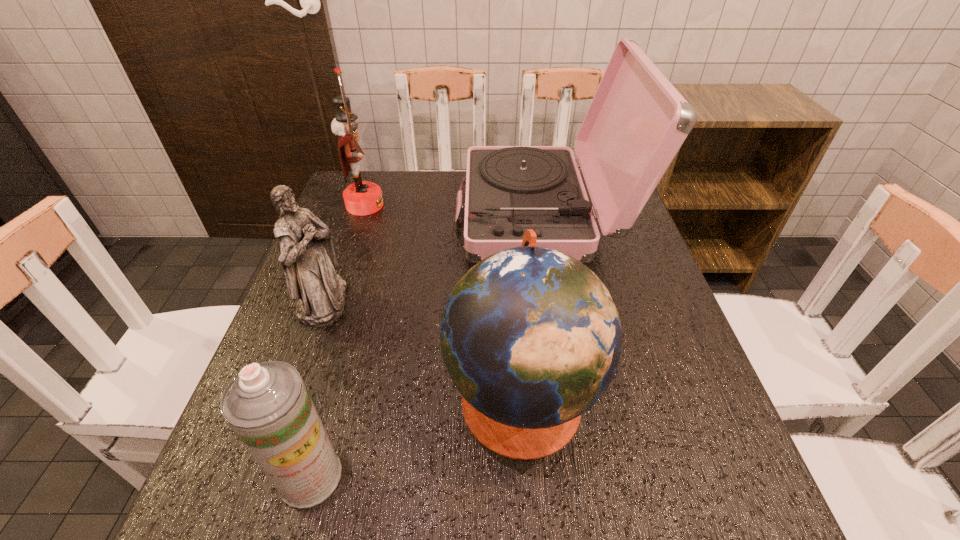
Where is `free space between the record player and the aerosol can`? The image size is (960, 540). free space between the record player and the aerosol can is located at coordinates (426, 346).

Image resolution: width=960 pixels, height=540 pixels. Find the location of `vacant region between the globe and the third farthest object`. vacant region between the globe and the third farthest object is located at coordinates (422, 349).

Where is `unoccupied position between the record player and the nutcracker`? Image resolution: width=960 pixels, height=540 pixels. unoccupied position between the record player and the nutcracker is located at coordinates (453, 210).

What are the coordinates of `vacant point located between the aerosol can and the figurine` in the screenshot? It's located at (317, 389).

Identify the location of unoccupied area between the globe and the aerosol can. (416, 436).

At what (x,y) coordinates should I click in order to perform the action: click on vacant space that's between the nutcracker and the record player. Please return your answer as a coordinate pair (x, y). The height and width of the screenshot is (540, 960). Looking at the image, I should click on (453, 210).

This screenshot has height=540, width=960. Find the location of `unoccupied position between the nutcracker and the aerosol can`. unoccupied position between the nutcracker and the aerosol can is located at coordinates (338, 341).

Locate an element on the screen. empty space that is in between the record player and the aerosol can is located at coordinates (426, 346).

This screenshot has width=960, height=540. Identify the location of vacant space in between the nutcracker and the globe. (443, 301).

The width and height of the screenshot is (960, 540). Find the location of `free space between the record player and the aerosol can`. free space between the record player and the aerosol can is located at coordinates pyautogui.click(x=426, y=346).